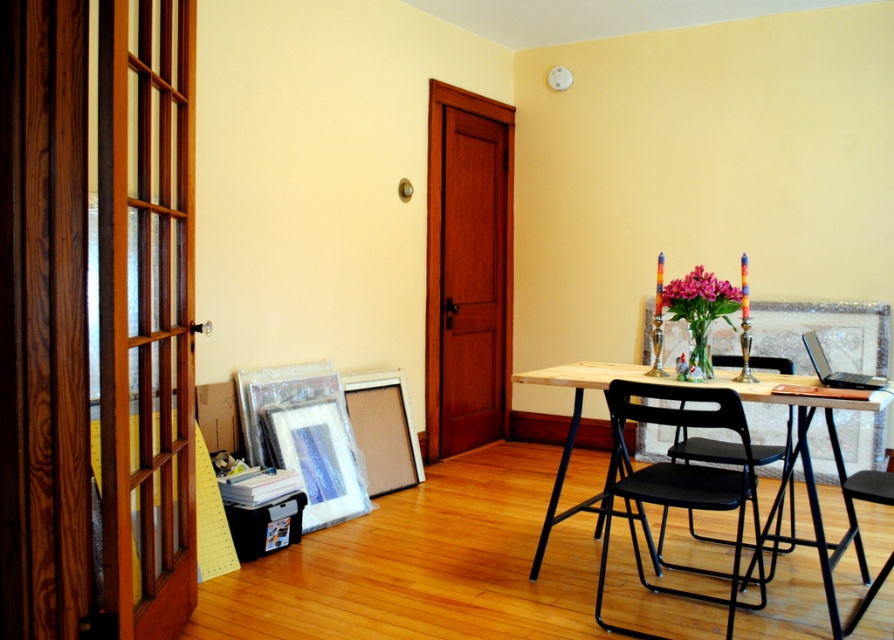
Does black plastic chair at center have a greater width compared to pink glossy flowers at center?

Indeed, black plastic chair at center has a greater width compared to pink glossy flowers at center.

Is point (597, 620) farther from viewer compared to point (699, 288)?

No, it is in front of (699, 288).

Between point (744, 508) and point (693, 292), which one is positioned behind?

The point (744, 508) is behind.

Locate an element on the screen. This screenshot has height=640, width=894. black plastic chair at center is located at coordinates (680, 481).

Which is behind, point (702, 456) or point (690, 273)?

Point (690, 273)

Which is below, black metal chair at lower right or pink glossy flowers at center?

Positioned lower is black metal chair at lower right.

Which is in front, point (783, 365) or point (688, 285)?

Positioned in front is point (688, 285).

Identify the location of black metal chair at lower right. The height and width of the screenshot is (640, 894). (702, 449).

Is black plastic chair at center thinner than black plastic chair at right?

No.

Between point (732, 508) and point (891, 476), which one is positioned behind?

Point (732, 508)

Which is behind, point (761, 596) or point (873, 586)?

Point (761, 596)

Identify the location of black plastic chair at center. (680, 481).